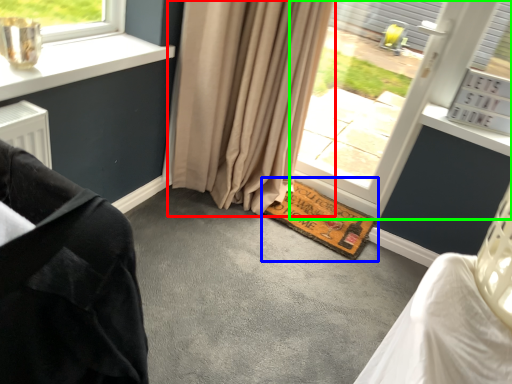
Question: Estimate the real-world distances between objects in this image. Which object is closer to curtain (highlighted by a red box), doormat (highlighted by a blue box) or window (highlighted by a green box)?

Choices:
 (A) doormat
 (B) window

Answer: (A)